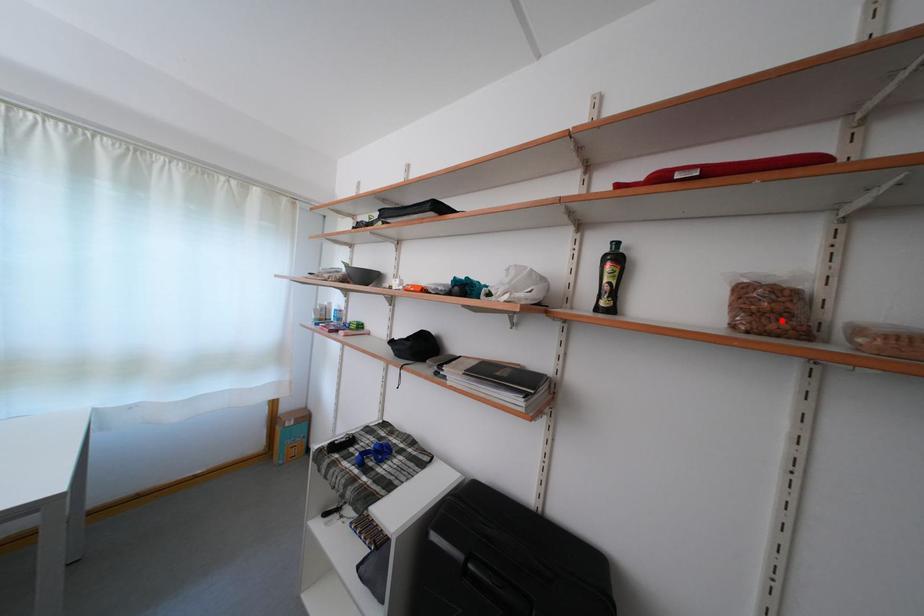
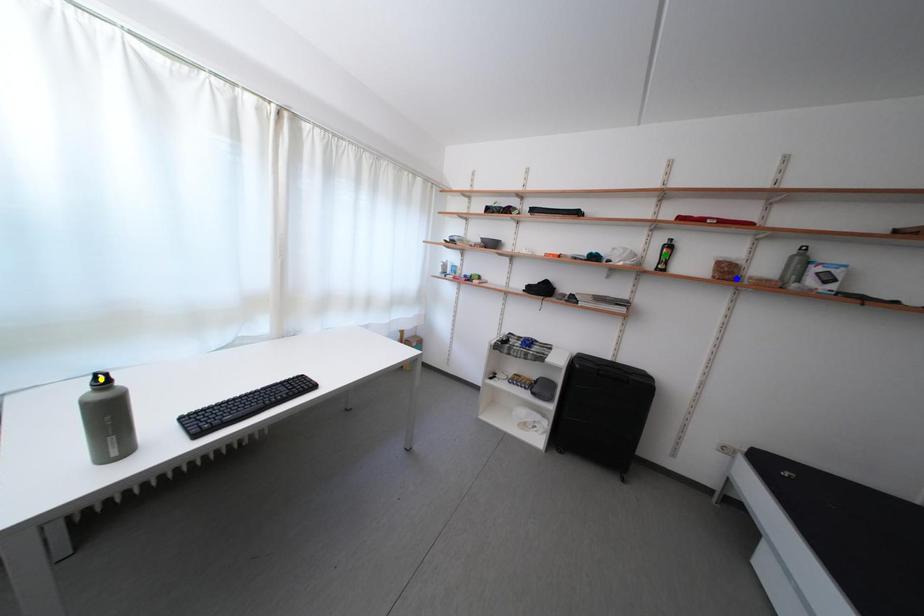
Question: I am providing you with two images of the same scene from different viewpoints. A red point is marked on the first image. You are given multiple points on the second image. In image 2, which mark is for the same physical point as the one in image 1?

Choices:
 (A) yellow point
 (B) blue point
 (C) green point

Answer: (B)